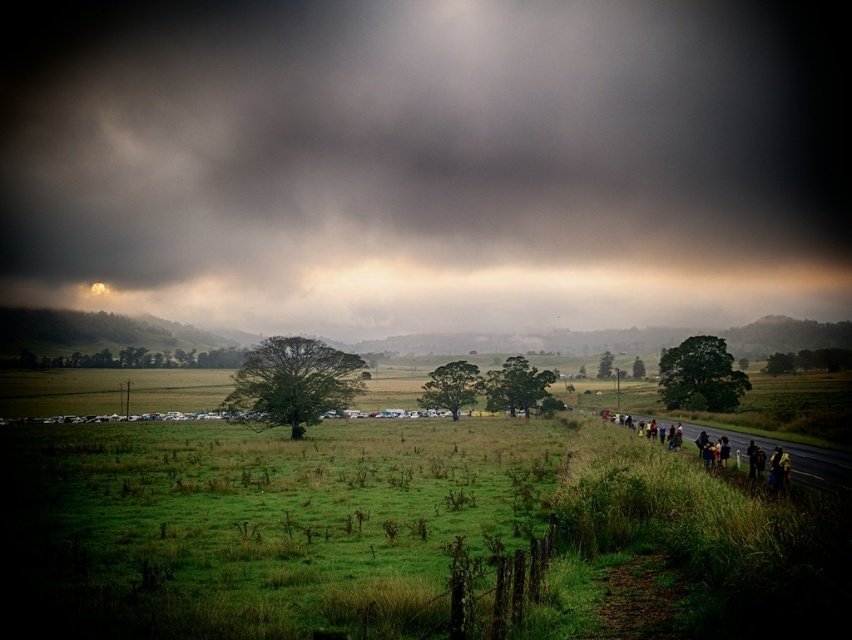
You are standing in the rural landscape scene. There is a dark gray cloud at upper center located at point (427, 161). What is the color of the object at that point?

The object at point (427, 161) is a dark gray cloud at upper center.

You are planning to take a photo of the yellow fabric people at lower right and the dark gray cloud at upper center. Which object should you focus on first if you want to capture both in a single shot without moving the camera?

You should focus on the dark gray cloud at upper center first because it is larger in size than the yellow fabric people at lower right, allowing it to be more prominent in the frame.

You are planning to set up a tent for an outdoor event. You have a tent that requires a clear space of 150 meters between the dark gray cloud at upper center and the yellow fabric people at lower right. Is the distance sufficient?

The dark gray cloud at upper center and yellow fabric people at lower right are 175.10 meters apart, which is more than the required 150 meters, so the distance is sufficient.